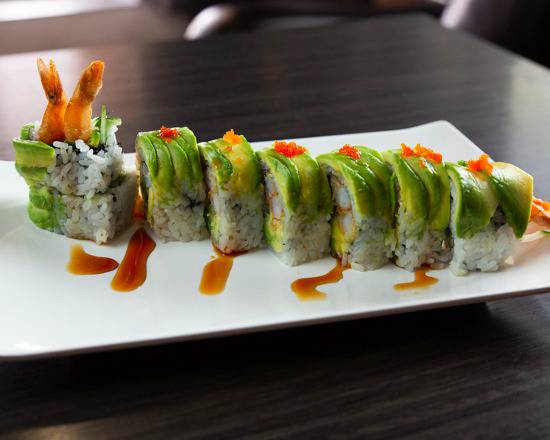
The width and height of the screenshot is (550, 440). Identify the location of shadow below the sushi plate. (315, 350).